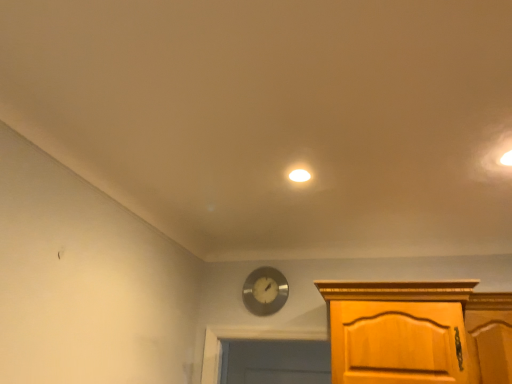
Question: Is metallic silver clock at center aimed at white matte light fixture at center?

Choices:
 (A) yes
 (B) no

Answer: (A)

Question: Is metallic silver clock at center further to camera compared to white matte light fixture at center?

Choices:
 (A) yes
 (B) no

Answer: (A)

Question: Is metallic silver clock at center smaller than white matte light fixture at center?

Choices:
 (A) no
 (B) yes

Answer: (A)

Question: Is metallic silver clock at center positioned far away from white matte light fixture at center?

Choices:
 (A) yes
 (B) no

Answer: (A)

Question: From a real-world perspective, is metallic silver clock at center on white matte light fixture at center?

Choices:
 (A) yes
 (B) no

Answer: (B)

Question: Can you confirm if metallic silver clock at center is thinner than white matte light fixture at center?

Choices:
 (A) yes
 (B) no

Answer: (A)

Question: Does white matte light fixture at center appear on the right side of metallic silver clock at center?

Choices:
 (A) yes
 (B) no

Answer: (A)

Question: From a real-world perspective, is white matte light fixture at center positioned over metallic silver clock at center based on gravity?

Choices:
 (A) no
 (B) yes

Answer: (B)

Question: Considering the relative sizes of white matte light fixture at center and metallic silver clock at center in the image provided, is white matte light fixture at center bigger than metallic silver clock at center?

Choices:
 (A) yes
 (B) no

Answer: (B)

Question: Is white matte light fixture at center taller than metallic silver clock at center?

Choices:
 (A) no
 (B) yes

Answer: (A)

Question: From the image's perspective, is white matte light fixture at center on top of metallic silver clock at center?

Choices:
 (A) no
 (B) yes

Answer: (B)

Question: Is white matte light fixture at center wider than metallic silver clock at center?

Choices:
 (A) yes
 (B) no

Answer: (A)

Question: Considering the positions of metallic silver clock at center and white matte light fixture at center in the image, is metallic silver clock at center wider or thinner than white matte light fixture at center?

Choices:
 (A) wide
 (B) thin

Answer: (B)